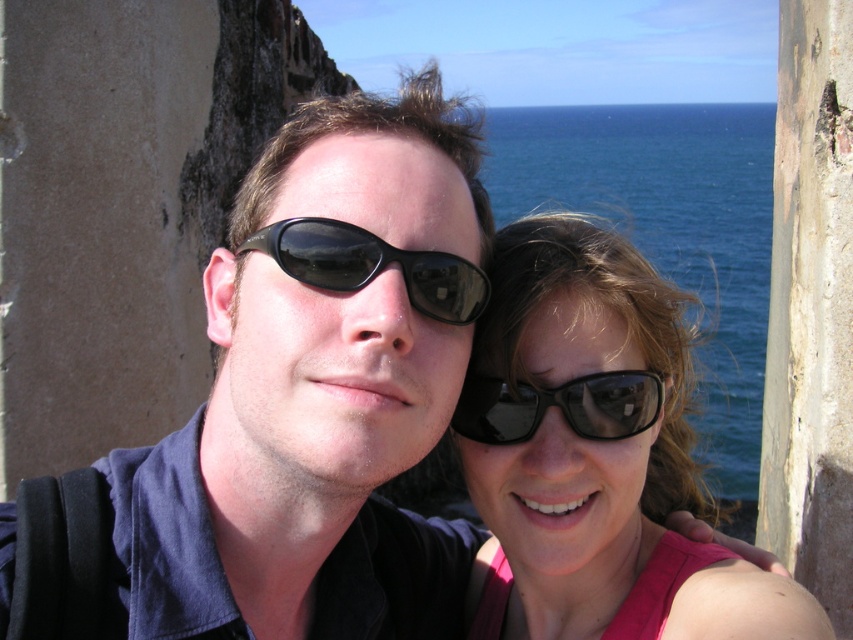
Which is more to the right, pink matte sunglasses at center or black plastic sunglasses at center?

Positioned to the right is pink matte sunglasses at center.

Is point (589, 614) positioned after point (543, 406)?

Yes, point (589, 614) is behind point (543, 406).

Locate an element on the screen. pink matte sunglasses at center is located at coordinates (589, 448).

Which is below, black reflective sunglasses at center or black plastic sunglasses at center?

black plastic sunglasses at center is below.

Which is more to the left, black reflective sunglasses at center or black plastic sunglasses at center?

From the viewer's perspective, black reflective sunglasses at center appears more on the left side.

Identify the location of black reflective sunglasses at center. (370, 266).

Can you confirm if pink matte sunglasses at center is positioned below black reflective sunglasses at center?

Yes, pink matte sunglasses at center is below black reflective sunglasses at center.

Who is more distant from viewer, (547, 580) or (309, 234)?

The point (547, 580) is more distant.

You are a GUI agent. You are given a task and a screenshot of the screen. Output one action in this format:
    pyautogui.click(x=<x>, y=<y>)
    Task: Click on the pink matte sunglasses at center
    The height and width of the screenshot is (640, 853).
    Given the screenshot: What is the action you would take?
    pyautogui.click(x=589, y=448)